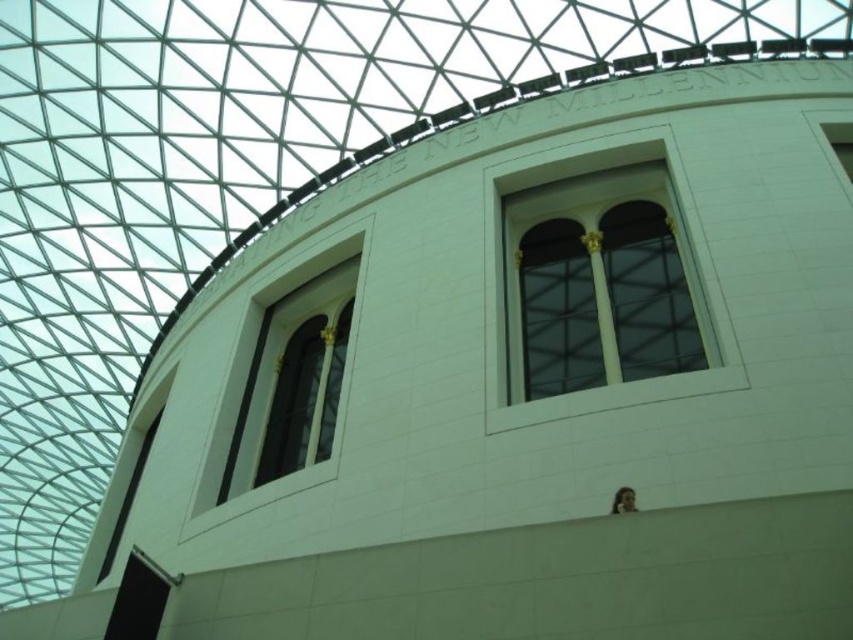
Question: Does matte glass window at upper left have a lesser width compared to matte glass window at upper center?

Choices:
 (A) yes
 (B) no

Answer: (A)

Question: Can you confirm if matte glass window at upper left is wider than matte glass window at upper center?

Choices:
 (A) yes
 (B) no

Answer: (B)

Question: Which object is closer to the camera taking this photo?

Choices:
 (A) matte glass window at upper left
 (B) matte glass window at upper center

Answer: (B)

Question: Is matte glass window at upper left wider than matte glass window at upper center?

Choices:
 (A) yes
 (B) no

Answer: (B)

Question: Which of the following is the closest to the observer?

Choices:
 (A) (350, 280)
 (B) (538, 164)

Answer: (B)